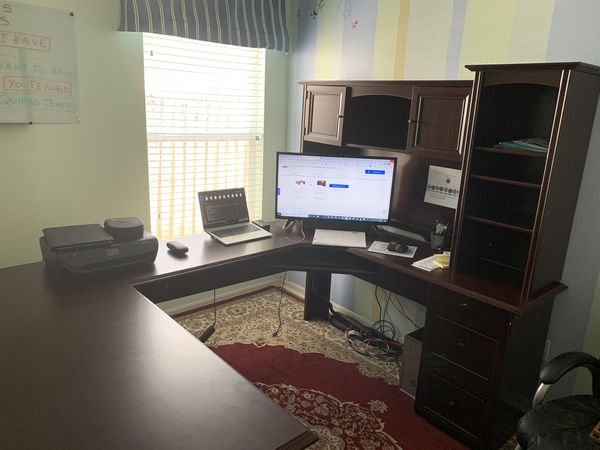
The width and height of the screenshot is (600, 450). In order to click on laptop computer in this screenshot , I will do `click(240, 234)`.